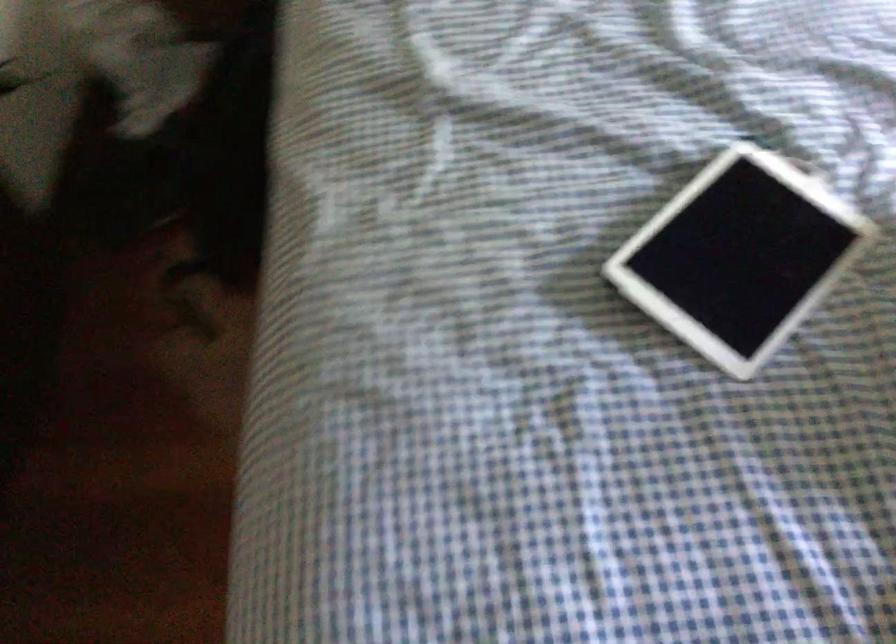
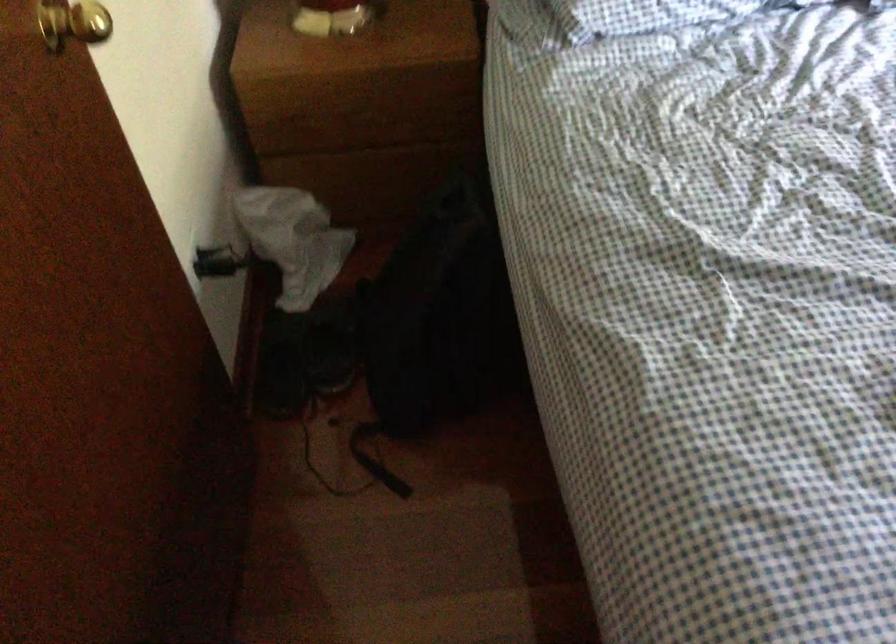
The point at (110, 192) is marked in the first image. Where is the corresponding point in the second image?

(282, 363)